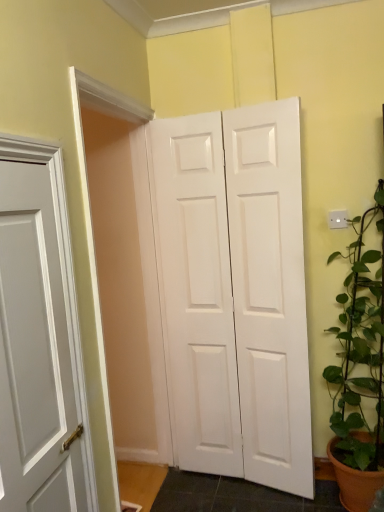
This screenshot has height=512, width=384. I want to click on free space in front of white matte door at center, so click(x=248, y=500).